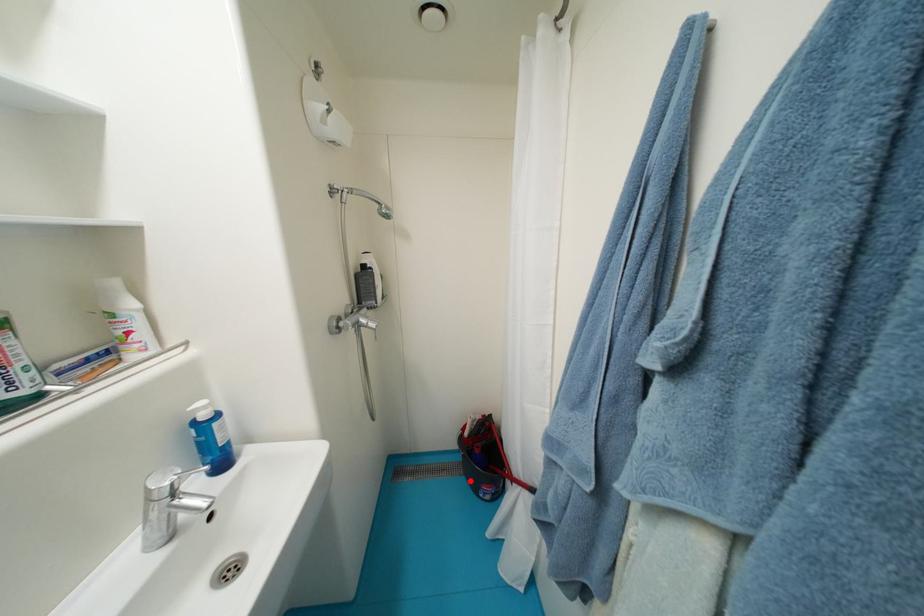
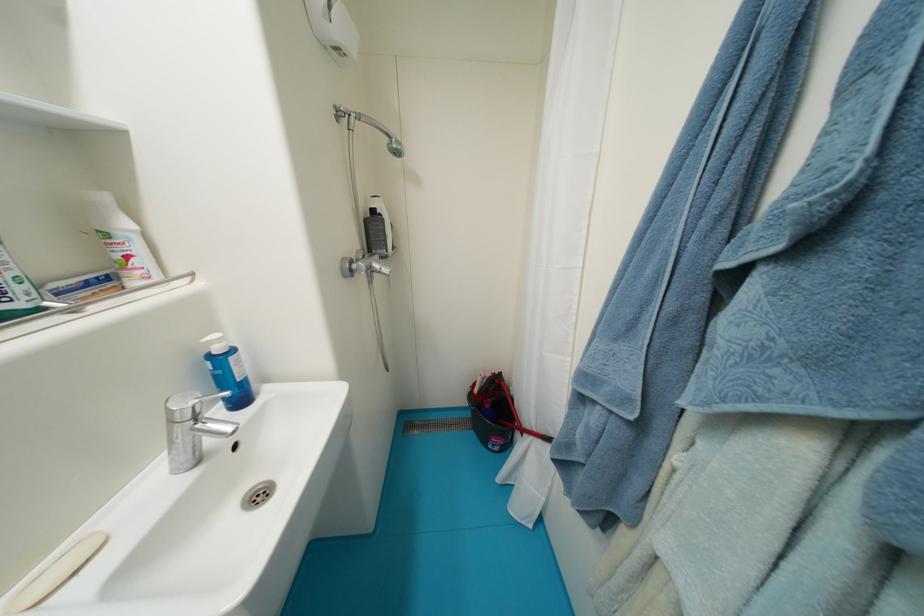
Question: I am providing you with two images of the same scene from different viewpoints. In image1, a red point is highlighted. Considering the same 3D point in image2, which of the following is correct?

Choices:
 (A) It is closer
 (B) It is farther

Answer: (A)